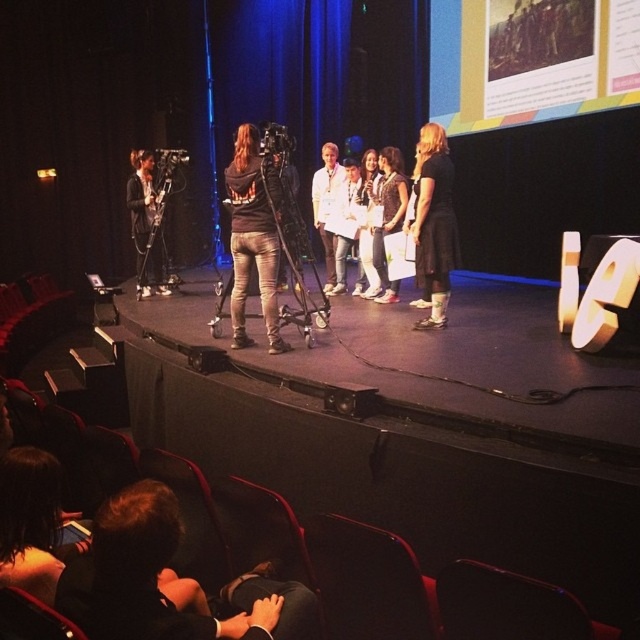
You are a photographer at the event and need to capture a photo of both the matte black dress at center and the white cotton dress at center. Which dress should you focus on first to ensure it fits properly in the frame?

The matte black dress at center is bigger than the white cotton dress at center, so you should focus on the matte black dress at center first to ensure it fits properly in the frame since it takes up more space.

You are a photographer positioned at the front row of the theater. You want to capture a closeup shot of the matte black dress at center. Which direction should you point your camera to get the best angle?

The matte black dress at center is located at point coordinates (x=388, y=216), so you should aim your camera towards the center of the stage slightly to the left to capture the best angle.

You are an event photographer positioned at the back of the theater. You need to capture a photo of both the matte black dress at center and the white matte shirt at center. Based on their positions, which one is lower in the frame?

The matte black dress at center is below the white matte shirt at center, so the matte black dress at center will appear lower in the frame.